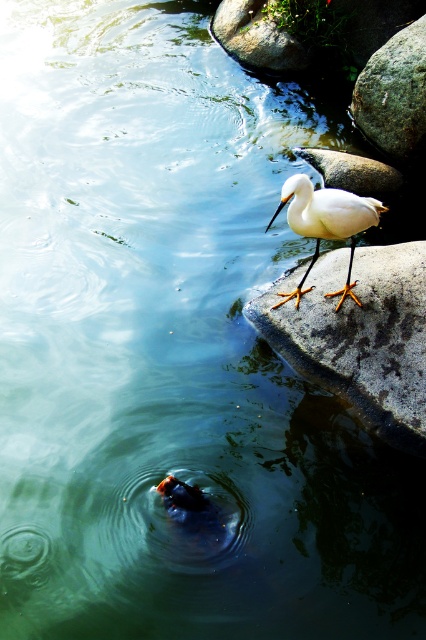
Question: Considering the relative positions of white matte stone at right and white matte bird at upper right in the image provided, where is white matte stone at right located with respect to white matte bird at upper right?

Choices:
 (A) below
 (B) above

Answer: (A)

Question: Which point appears farthest from the camera in this image?

Choices:
 (A) (331, 230)
 (B) (420, 358)
 (C) (370, 58)

Answer: (C)

Question: In this image, where is white matte stone at right located relative to smooth gray rock at upper right?

Choices:
 (A) left
 (B) right

Answer: (A)

Question: Which point is closer to the camera?

Choices:
 (A) white matte stone at right
 (B) white matte bird at upper right

Answer: (B)

Question: Among these objects, which one is farthest from the camera?

Choices:
 (A) white matte bird at upper right
 (B) smooth gray rock at upper right
 (C) white matte stone at right

Answer: (B)

Question: Is white matte stone at right closer to the viewer compared to white matte bird at upper right?

Choices:
 (A) no
 (B) yes

Answer: (A)